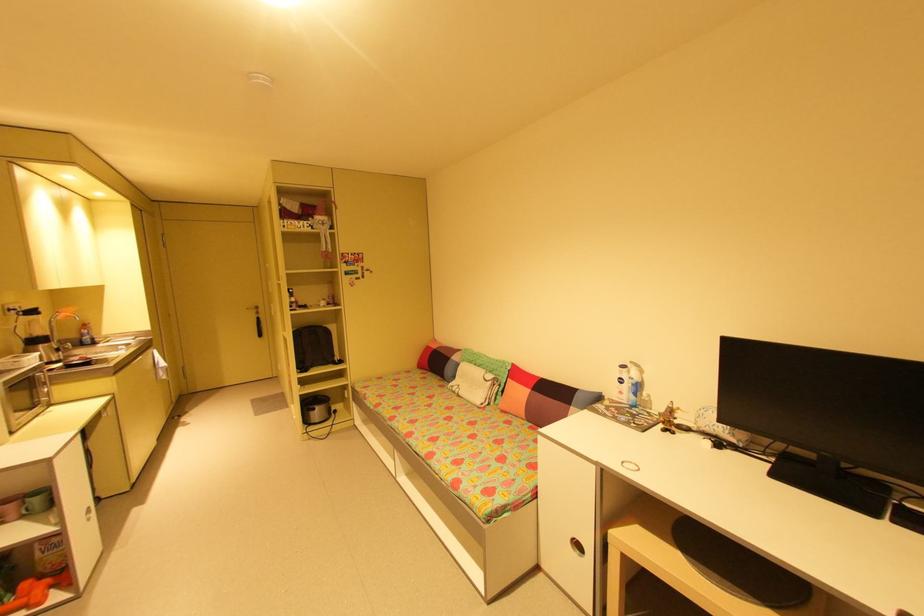
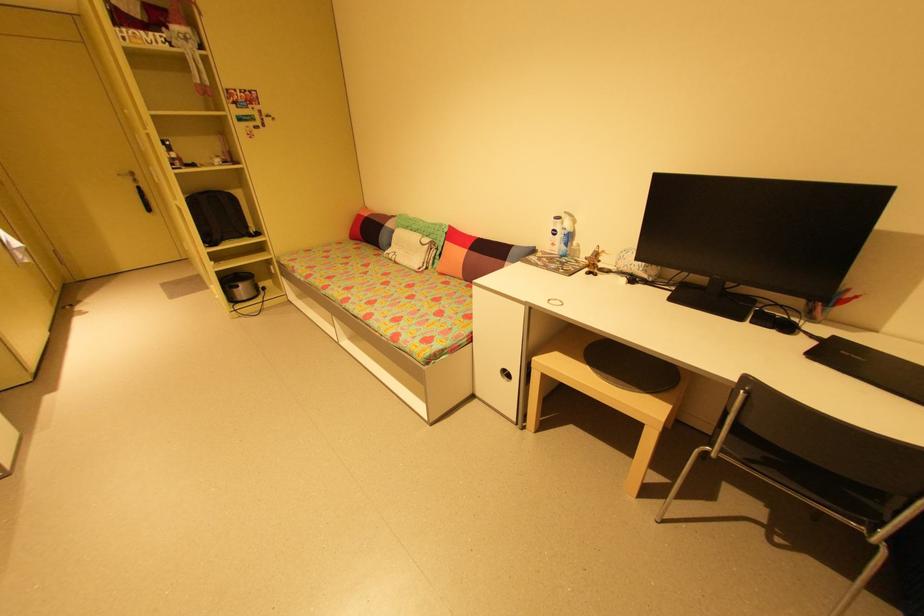
The point at (616, 532) is marked in the first image. Where is the corresponding point in the second image?

(540, 359)